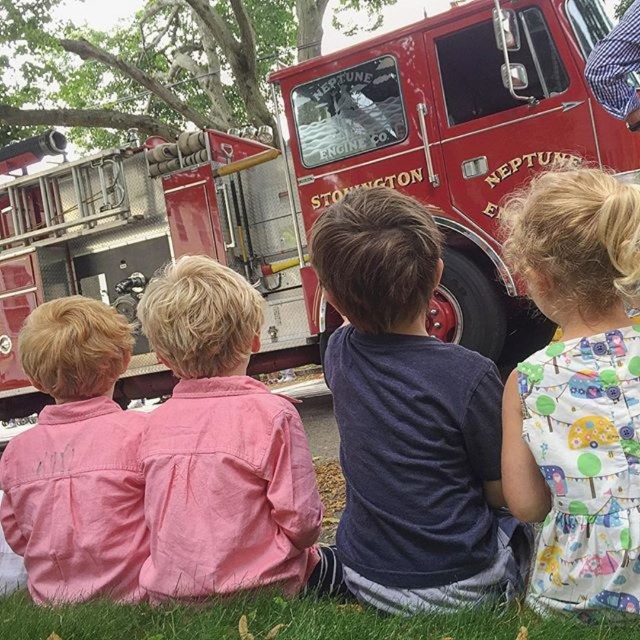
Which of these two, printed cotton dress at center or pink cotton shirt at center, stands taller?

printed cotton dress at center is taller.

Can you confirm if printed cotton dress at center is bigger than pink cotton shirt at center?

No.

Which is in front, point (536, 563) or point (182, 292)?

Positioned in front is point (536, 563).

This screenshot has width=640, height=640. Identify the location of printed cotton dress at center. click(x=577, y=388).

Is dark blue shirt at center closer to the viewer compared to pink cotton shirt at left?

That is True.

Is point (381, 554) closer to camera compared to point (67, 401)?

Yes, it is.

Find the location of a particular element. The height and width of the screenshot is (640, 640). dark blue shirt at center is located at coordinates (410, 420).

Find the location of a particular element. This screenshot has height=640, width=640. dark blue shirt at center is located at coordinates (410, 420).

Is the position of dark blue shirt at center less distant than that of pink cotton shirt at center?

That is True.

Is point (332, 365) positioned before point (163, 433)?

Yes, point (332, 365) is in front of point (163, 433).

This screenshot has width=640, height=640. What are the coordinates of `dark blue shirt at center` in the screenshot? It's located at (410, 420).